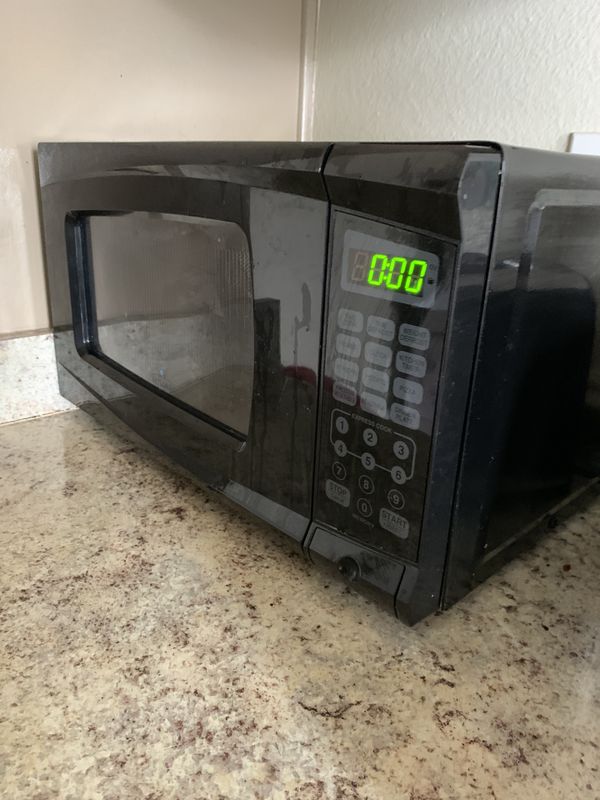
Where is `screen`? This screenshot has height=800, width=600. screen is located at coordinates (224, 417).